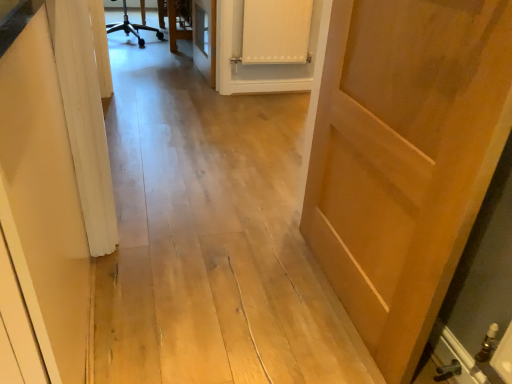
Question: Is white matte cabinet at upper center not within matte wood door at right?

Choices:
 (A) no
 (B) yes

Answer: (B)

Question: Is white matte cabinet at upper center surrounding matte wood door at right?

Choices:
 (A) yes
 (B) no

Answer: (B)

Question: Can you confirm if white matte cabinet at upper center is bigger than matte wood door at right?

Choices:
 (A) yes
 (B) no

Answer: (B)

Question: Would you say white matte cabinet at upper center is a long distance from matte wood door at right?

Choices:
 (A) no
 (B) yes

Answer: (B)

Question: Does white matte cabinet at upper center appear on the left side of matte wood door at right?

Choices:
 (A) no
 (B) yes

Answer: (B)

Question: Is white matte cabinet at upper center wider than matte wood door at right?

Choices:
 (A) no
 (B) yes

Answer: (A)

Question: From a real-world perspective, is matte wood door at right located beneath white matte cabinet at upper center?

Choices:
 (A) no
 (B) yes

Answer: (A)

Question: Is there a large distance between matte wood door at right and white matte cabinet at upper center?

Choices:
 (A) yes
 (B) no

Answer: (A)

Question: From the image's perspective, would you say matte wood door at right is positioned over white matte cabinet at upper center?

Choices:
 (A) yes
 (B) no

Answer: (B)

Question: Does matte wood door at right touch white matte cabinet at upper center?

Choices:
 (A) yes
 (B) no

Answer: (B)

Question: Is matte wood door at right shorter than white matte cabinet at upper center?

Choices:
 (A) yes
 (B) no

Answer: (B)

Question: Is white matte cabinet at upper center at the back of matte wood door at right?

Choices:
 (A) yes
 (B) no

Answer: (B)

Question: Choose the correct answer: Is white matte cabinet at upper center inside matte wood door at right or outside it?

Choices:
 (A) inside
 (B) outside

Answer: (B)